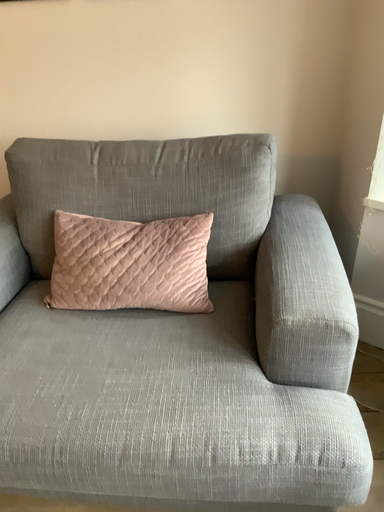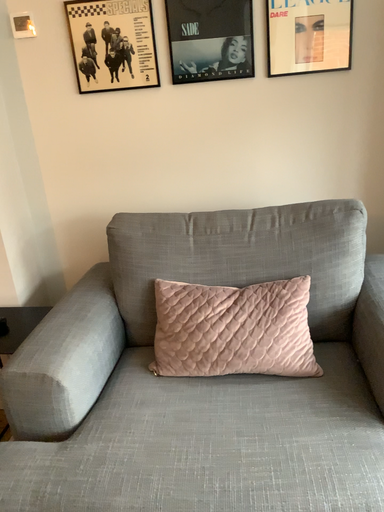
Question: Which way did the camera rotate in the video?

Choices:
 (A) rotated downward
 (B) rotated upward

Answer: (B)